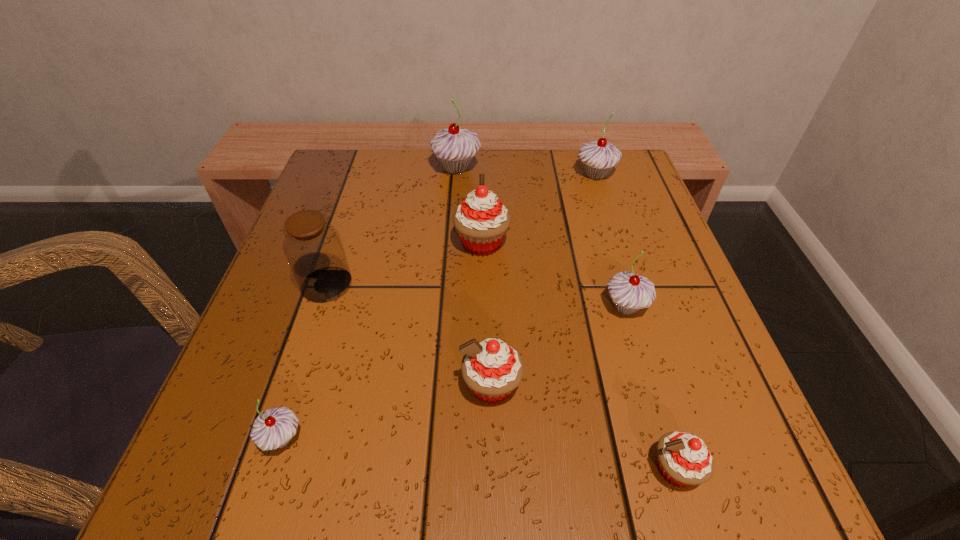
Identify the location of vacant space situated 0.210m on the right of the leftmost gray cupcake. This screenshot has height=540, width=960. (458, 438).

The height and width of the screenshot is (540, 960). In order to click on vacant region located 0.210m on the left of the rightmost pink cupcake in this screenshot , I will do (487, 469).

The height and width of the screenshot is (540, 960). Find the location of `jar that is at the left edge`. jar that is at the left edge is located at coordinates (314, 250).

Where is `cupcake located at the left edge`? This screenshot has width=960, height=540. cupcake located at the left edge is located at coordinates (274, 428).

Locate an element on the screen. The width and height of the screenshot is (960, 540). object at the near left corner is located at coordinates (274, 428).

This screenshot has height=540, width=960. In order to click on object positioned at the far right corner in this screenshot , I will do `click(599, 157)`.

You are a GUI agent. You are given a task and a screenshot of the screen. Output one action in this format:
    pyautogui.click(x=<x>, y=<y>)
    Task: Click on the object present at the near right corner
    
    Given the screenshot: What is the action you would take?
    pyautogui.click(x=684, y=459)

This screenshot has width=960, height=540. In the image, there is a desktop. Identify the location of vacant area at the far edge. (430, 168).

I want to click on vacant space at the near edge of the desktop, so click(x=492, y=507).

You are a GUI agent. You are given a task and a screenshot of the screen. Output one action in this format:
    pyautogui.click(x=<x>, y=<y>)
    Task: Click on the free space at the left edge of the desktop
    
    Given the screenshot: What is the action you would take?
    pyautogui.click(x=274, y=305)